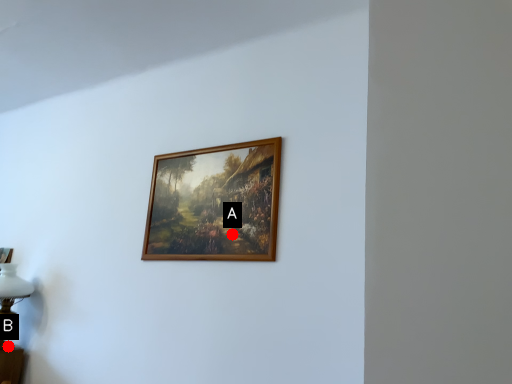
Question: Two points are circled on the image, labeled by A and B beside each circle. Which point appears farthest from the camera in this image?

Choices:
 (A) A is further
 (B) B is further

Answer: (B)